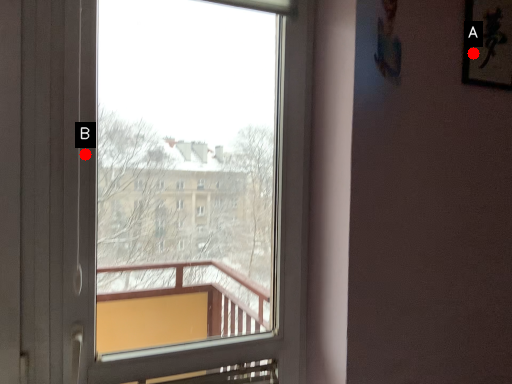
Question: Two points are circled on the image, labeled by A and B beside each circle. Which of the following is the farthest from the observer?

Choices:
 (A) A is further
 (B) B is further

Answer: (A)